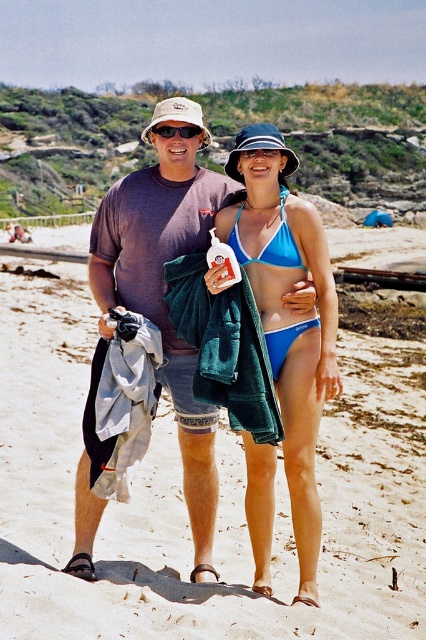
What do you see at coordinates (270, 243) in the screenshot?
I see `blue matte bikini at center` at bounding box center [270, 243].

Which of these two, blue matte bikini at center or matte black sunglasses at center, stands taller?

With more height is blue matte bikini at center.

Where is `blue matte bikini at center`? blue matte bikini at center is located at coordinates (270, 243).

Does blue matte bikini at center have a lesser height compared to blue fabric bikini top at center?

Incorrect, blue matte bikini at center's height does not fall short of blue fabric bikini top at center's.

Measure the distance between blue matte bikini at center and camera.

They are 11.97 meters apart.

Does point (271, 360) lie in front of point (241, 244)?

Yes, point (271, 360) is in front of point (241, 244).

Image resolution: width=426 pixels, height=640 pixels. What are the coordinates of `blue matte bikini at center` in the screenshot? It's located at (270, 243).

Can you confirm if blue bikini at center is shorter than blue matte bikini at center?

In fact, blue bikini at center may be taller than blue matte bikini at center.

Between blue bikini at center and blue matte bikini at center, which one has more height?

With more height is blue bikini at center.

Is point (253, 525) closer to viewer compared to point (238, 227)?

Yes, point (253, 525) is closer to viewer.

Identify the location of blue bikini at center. Image resolution: width=426 pixels, height=640 pixels. (287, 316).